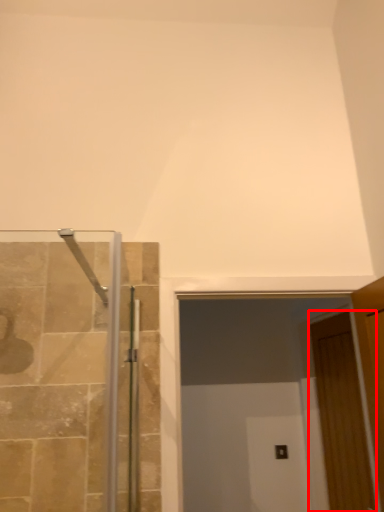
Question: From the image's perspective, what is the correct spatial relationship of door (annotated by the red box) in relation to glass door?

Choices:
 (A) above
 (B) below

Answer: (B)